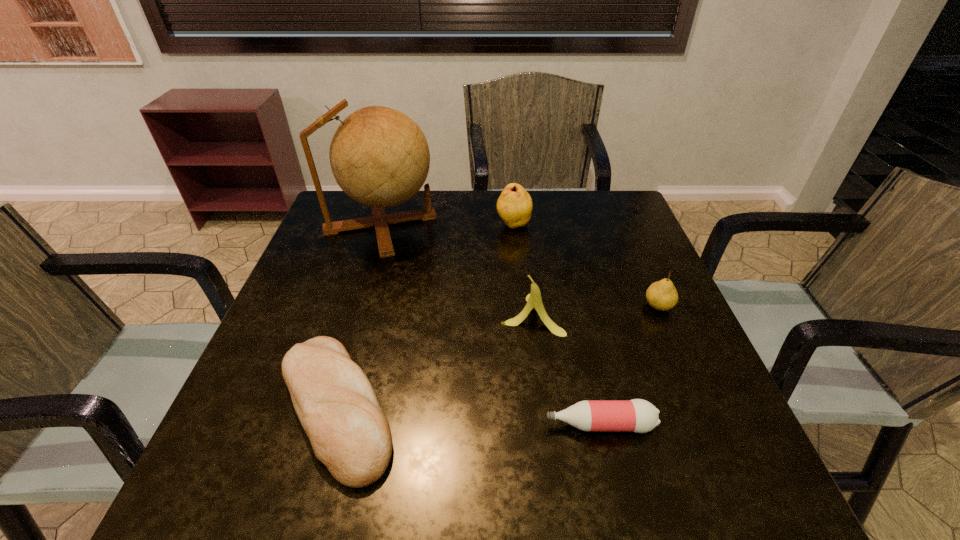
Find the location of a particular element. free space between the third shortest object and the bottle is located at coordinates (629, 365).

This screenshot has width=960, height=540. I want to click on free area in between the shortest object and the tallest object, so (491, 325).

Where is `empty space that is in between the left pear and the banana`? empty space that is in between the left pear and the banana is located at coordinates (522, 269).

At what (x,y) coordinates should I click in order to perform the action: click on free space that is in between the bread and the taller pear. Please return your answer as a coordinate pair (x, y). This screenshot has height=540, width=960. Looking at the image, I should click on (424, 316).

At what (x,y) coordinates should I click in order to perform the action: click on free space between the tallest object and the farther pear. Please return your answer as a coordinate pair (x, y). The image size is (960, 540). Looking at the image, I should click on (447, 224).

Locate an element on the screen. This screenshot has width=960, height=540. free space between the taller pear and the tallest object is located at coordinates point(447,224).

Locate an element on the screen. free space between the tallest object and the rightmost object is located at coordinates (519, 265).

Find the location of a particular element. This screenshot has width=960, height=540. free point between the tallest object and the banana is located at coordinates (456, 269).

Image resolution: width=960 pixels, height=540 pixels. I want to click on vacant area between the globe and the shorter pear, so click(519, 265).

The image size is (960, 540). Find the location of `free spot between the left pear and the banana`. free spot between the left pear and the banana is located at coordinates (522, 269).